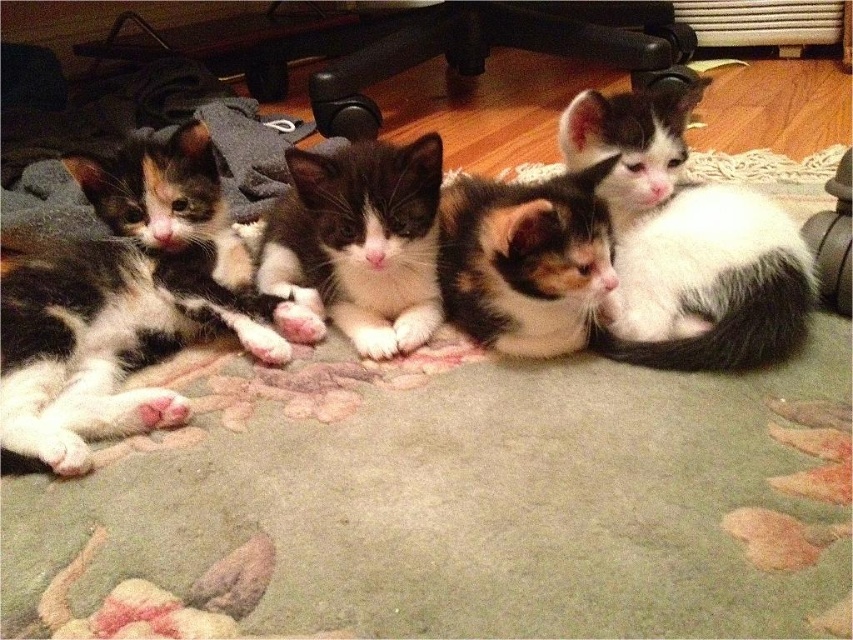
Does point (24, 330) come behind point (531, 339)?

No, (24, 330) is in front of (531, 339).

How much distance is there between calico fur kitten at left and calico fur cat at center?

They are 36.16 centimeters apart.

I want to click on calico fur kitten at left, so click(x=126, y=305).

Can you confirm if white and black fur cat at upper right is positioned above calico fur cat at center?

Indeed, white and black fur cat at upper right is positioned over calico fur cat at center.

Does white and black fur cat at upper right have a lesser width compared to calico fur cat at center?

Incorrect, white and black fur cat at upper right's width is not less than calico fur cat at center's.

The height and width of the screenshot is (640, 853). What do you see at coordinates (686, 243) in the screenshot? I see `white and black fur cat at upper right` at bounding box center [686, 243].

Image resolution: width=853 pixels, height=640 pixels. In order to click on white and black fur cat at upper right in this screenshot , I will do `click(686, 243)`.

Measure the distance between calico fur kitten at left and camera.

calico fur kitten at left and camera are 33.11 inches apart.

What do you see at coordinates (126, 305) in the screenshot?
I see `calico fur kitten at left` at bounding box center [126, 305].

Is point (106, 310) closer to camera compared to point (624, 176)?

Yes, point (106, 310) is in front of point (624, 176).

Where is `calico fur kitten at left`? calico fur kitten at left is located at coordinates (126, 305).